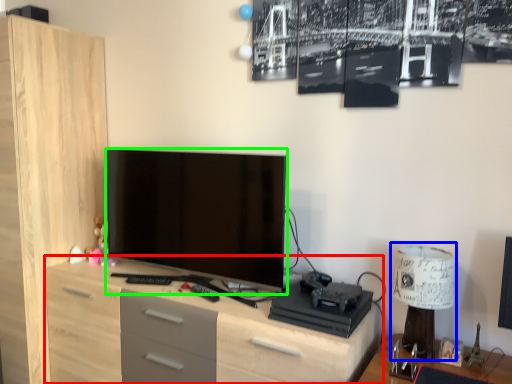
Question: Considering the real-world distances, which object is closest to chest of drawers (highlighted by a red box)? table lamp (highlighted by a blue box) or television (highlighted by a green box).

Choices:
 (A) table lamp
 (B) television

Answer: (B)